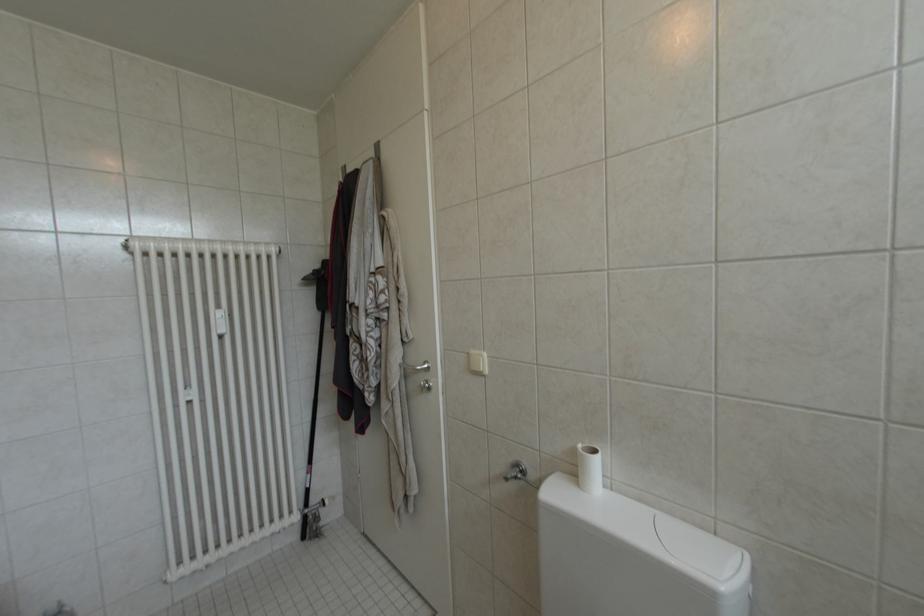
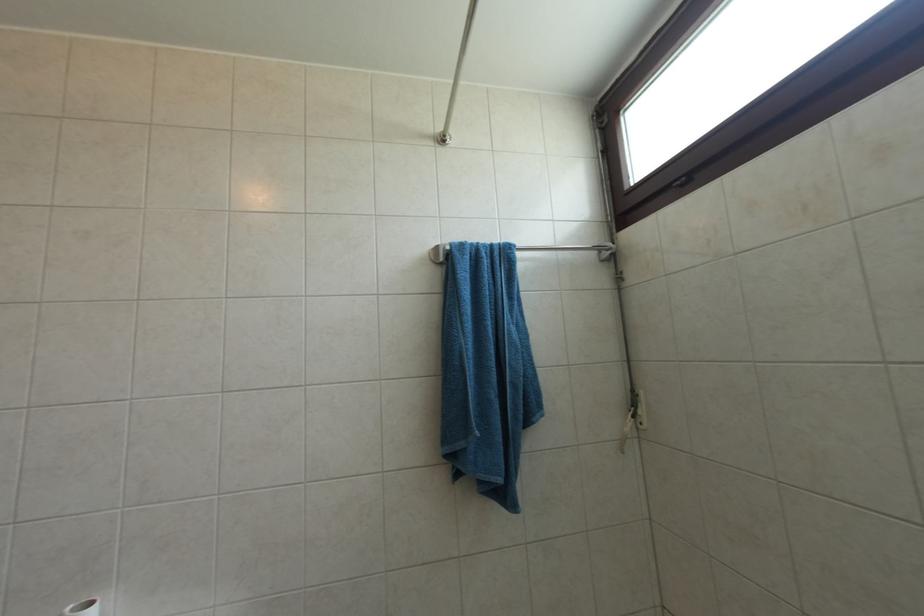
Question: The camera is either moving clockwise (left) or counter-clockwise (right) around the object. The first image is from the beginning of the video and the second image is from the end. Is the camera moving left or right when shooting the video?

Choices:
 (A) Left
 (B) Right

Answer: (A)